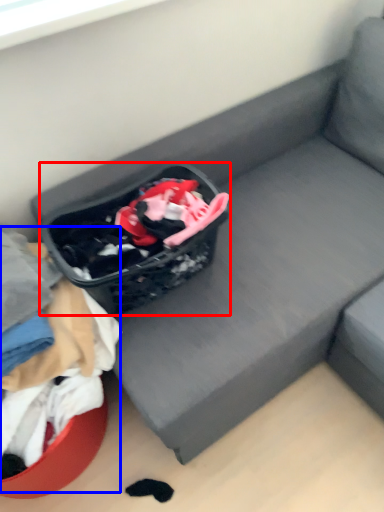
Question: Among these objects, which one is nearest to the camera, shopping basket (highlighted by a red box) or clothing (highlighted by a blue box)?

Choices:
 (A) shopping basket
 (B) clothing

Answer: (B)